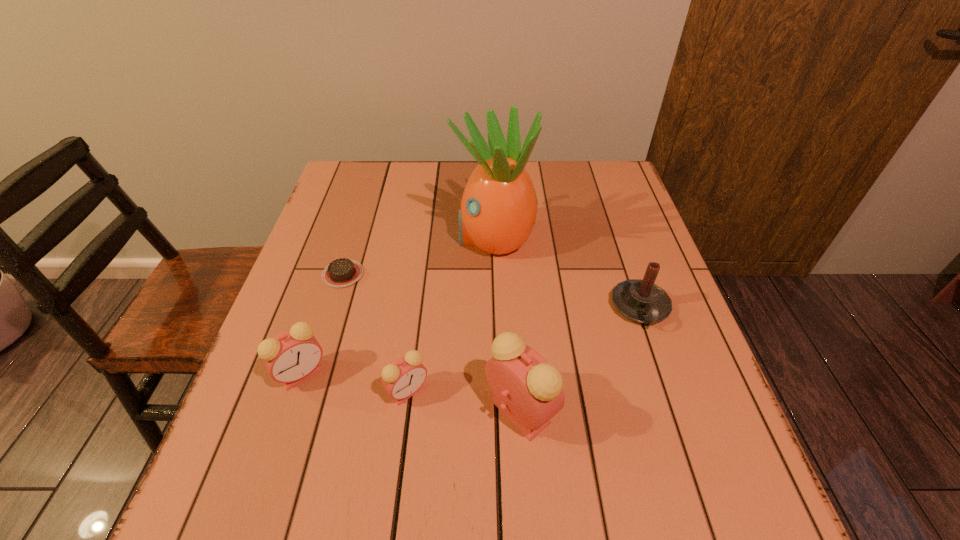
In the current image, all alarm clocks are evenly spaced. To maintain this equal spacing, where should an additional alarm clock be placed on the right? Please point out a free spot. Please provide its 2D coordinates. Your answer should be formatted as a tuple, i.e. [(x, y)], where the tuple contains the x and y coordinates of a point satisfying the conditions above.

[(641, 430)]